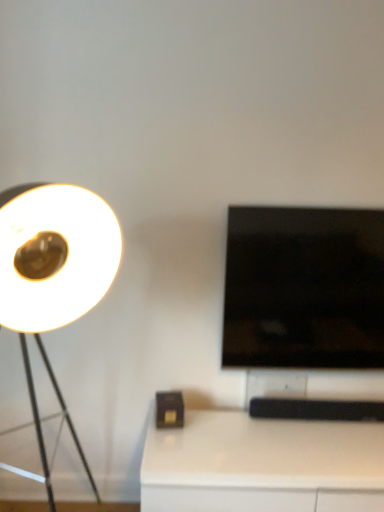
Question: Would you say black glossy tv at right is to the left or to the right of white matte lamp at left in the picture?

Choices:
 (A) right
 (B) left

Answer: (A)

Question: Considering the positions of black glossy tv at right and white matte lamp at left in the image, is black glossy tv at right taller or shorter than white matte lamp at left?

Choices:
 (A) tall
 (B) short

Answer: (B)

Question: Estimate the real-world distances between objects in this image. Which object is closer to the white glossy table at lower right?

Choices:
 (A) white matte lamp at left
 (B) black glossy tv at right

Answer: (B)

Question: Based on their relative distances, which object is nearer to the black glossy tv at right?

Choices:
 (A) white glossy table at lower right
 (B) white matte lamp at left

Answer: (A)